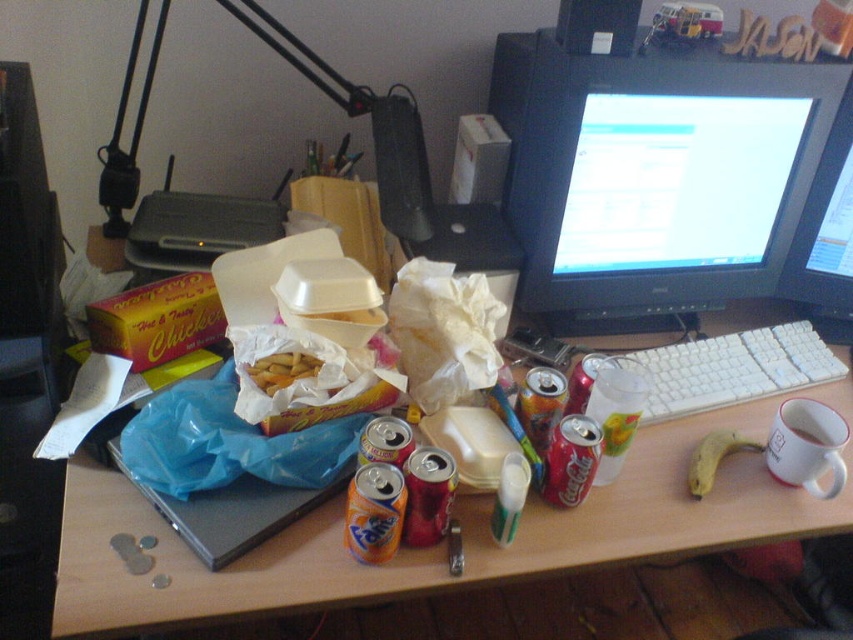
Between yellow matte banana at center and yellow crispy french fries at center, which one has less height?

yellow crispy french fries at center is shorter.

Which is in front, point (743, 449) or point (270, 365)?

Positioned in front is point (270, 365).

This screenshot has width=853, height=640. What do you see at coordinates (714, 458) in the screenshot?
I see `yellow matte banana at center` at bounding box center [714, 458].

What are the coordinates of `yellow matte banana at center` in the screenshot? It's located at (714, 458).

Consider the image. Does wooden desk at center have a smaller size compared to black glossy monitor at center?

No.

Can you confirm if wooden desk at center is positioned to the left of black glossy monitor at center?

Yes, wooden desk at center is to the left of black glossy monitor at center.

Which is in front, point (409, 582) or point (842, 273)?

Positioned in front is point (409, 582).

The height and width of the screenshot is (640, 853). I want to click on wooden desk at center, so click(440, 547).

From the picture: Can you confirm if wooden desk at center is taller than black plastic lamp at upper left?

In fact, wooden desk at center may be shorter than black plastic lamp at upper left.

From the picture: Is wooden desk at center smaller than black plastic lamp at upper left?

No.

Identify the location of wooden desk at center. This screenshot has width=853, height=640. (440, 547).

At what (x,y) coordinates should I click in order to perform the action: click on wooden desk at center. Please return your answer as a coordinate pair (x, y). Looking at the image, I should click on (440, 547).